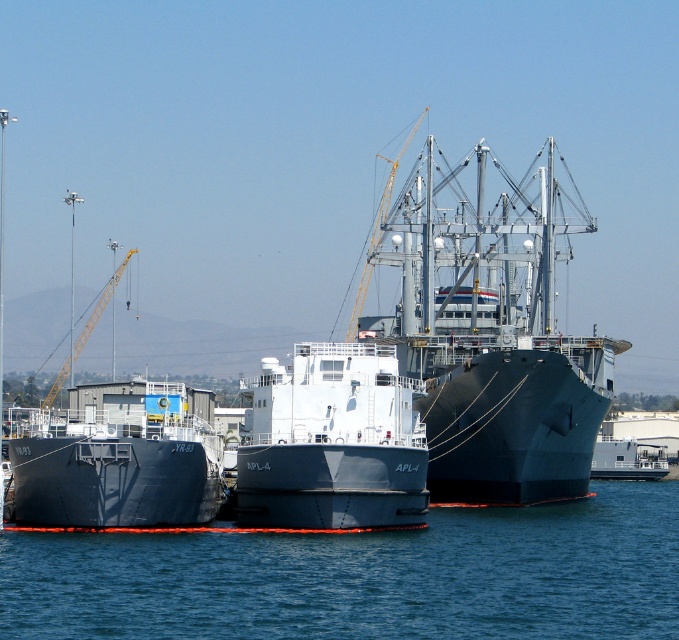
You are a marine biologist observing the port. You need to determine if a small research boat, which is 10 meters wide, can pass between the blue water at center and the matte black ship at center. Based on the scene, can it fit?

The blue water at center is wider than matte black ship at center, so the research boat which is 10 meters wide can pass through the space between them.

You are a sailor on the deck of the cargo ship APL 4. You notice two objects in the scene. One is the blue water at center and the metallic gray boat at center. Which object is higher in elevation?

The blue water at center is above the metallic gray boat at center, so the blue water at center is higher in elevation.

You are a port authority inspector assessing vessel dimensions. You observe the matte black ship at center and the matte gray ship at center. Which vessel has a greater height measurement?

The matte black ship at center is taller than the matte gray ship at center, so the matte black ship at center has a greater height measurement.